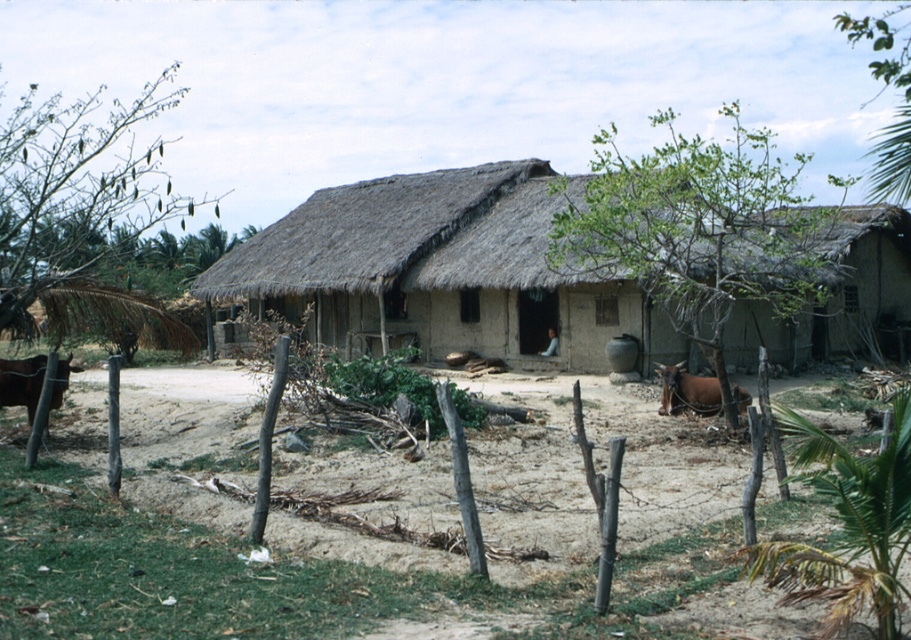
Can you confirm if thatched roof hut at center is positioned to the right of brown leather cow at left?

Yes, thatched roof hut at center is to the right of brown leather cow at left.

Which is more to the right, thatched roof hut at center or brown leather cow at left?

thatched roof hut at center is more to the right.

At what (x,y) coordinates should I click in order to perform the action: click on thatched roof hut at center. Please return your answer as a coordinate pair (x, y). Looking at the image, I should click on (437, 269).

Does point (735, 404) come in front of point (44, 362)?

Yes, point (735, 404) is closer to viewer.

Who is lower down, brown leather cow at center or brown leather cow at left?

brown leather cow at center

Does point (710, 380) lie behind point (28, 365)?

Yes, it is.

Where is `brown leather cow at center`? brown leather cow at center is located at coordinates (687, 392).

Is point (343, 307) closer to viewer compared to point (662, 371)?

No.

Which is behind, point (582, 349) or point (743, 403)?

The point (582, 349) is behind.

Locate an element on the screen. thatched roof hut at center is located at coordinates (437, 269).